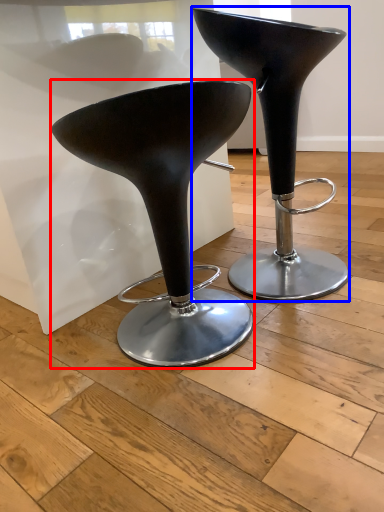
Question: Which point is further to the camera, stool (highlighted by a red box) or stool (highlighted by a blue box)?

Choices:
 (A) stool
 (B) stool

Answer: (B)